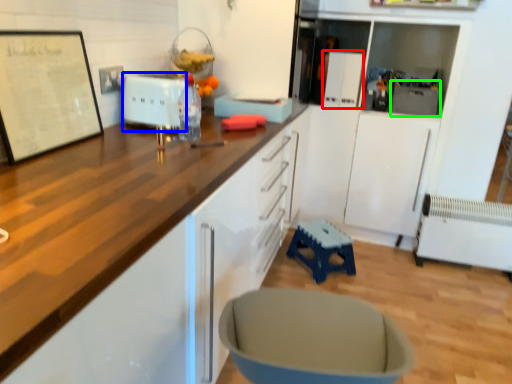
Question: Based on their relative distances, which object is farther from appliance (highlighted by a red box)? Choose from appliance (highlighted by a blue box) and appliance (highlighted by a green box).

Choices:
 (A) appliance
 (B) appliance

Answer: (A)